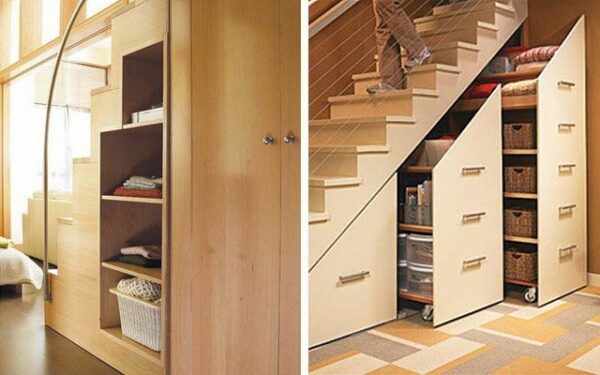
Locate an element on the screen. This screenshot has width=600, height=375. white couch is located at coordinates [x=39, y=216].